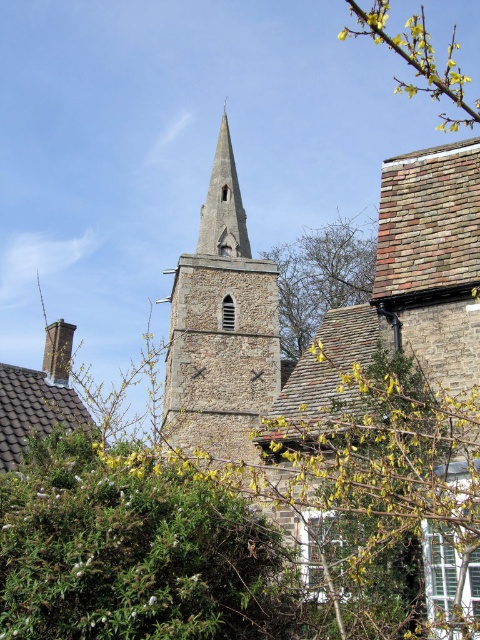
Question: Is brown stone church tower at center to the right of yellow flower at upper right from the viewer's perspective?

Choices:
 (A) no
 (B) yes

Answer: (A)

Question: In this image, where is brown stone church tower at center located relative to green leafy tree at center?

Choices:
 (A) right
 (B) left

Answer: (B)

Question: Which object is positioned closest to the green leafy tree at center?

Choices:
 (A) smooth stone spire at center
 (B) brown stone church tower at center

Answer: (A)

Question: Which point is closer to the camera taking this photo?

Choices:
 (A) (203, 208)
 (B) (304, 256)
 (C) (377, 6)

Answer: (C)

Question: Which object is farther from the camera taking this photo?

Choices:
 (A) smooth stone spire at center
 (B) green leafy tree at center

Answer: (B)

Question: Is brown stone church tower at center bigger than yellow flower at upper right?

Choices:
 (A) yes
 (B) no

Answer: (B)